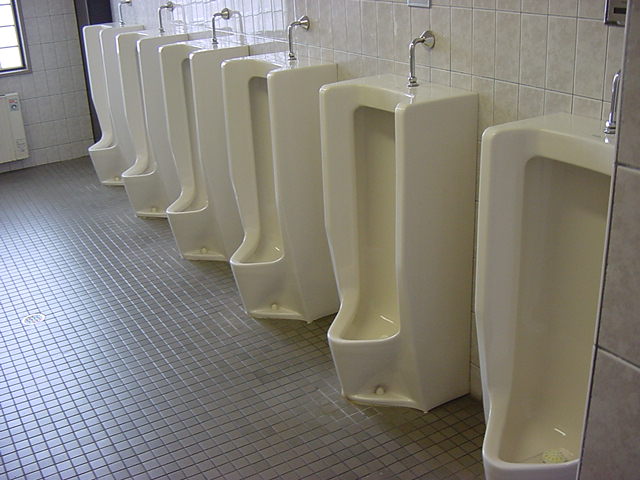
Locate an element on the screen. The height and width of the screenshot is (480, 640). first 4 urinals from the right side of the photo is located at coordinates (532, 333), (390, 249), (272, 192), (196, 158).